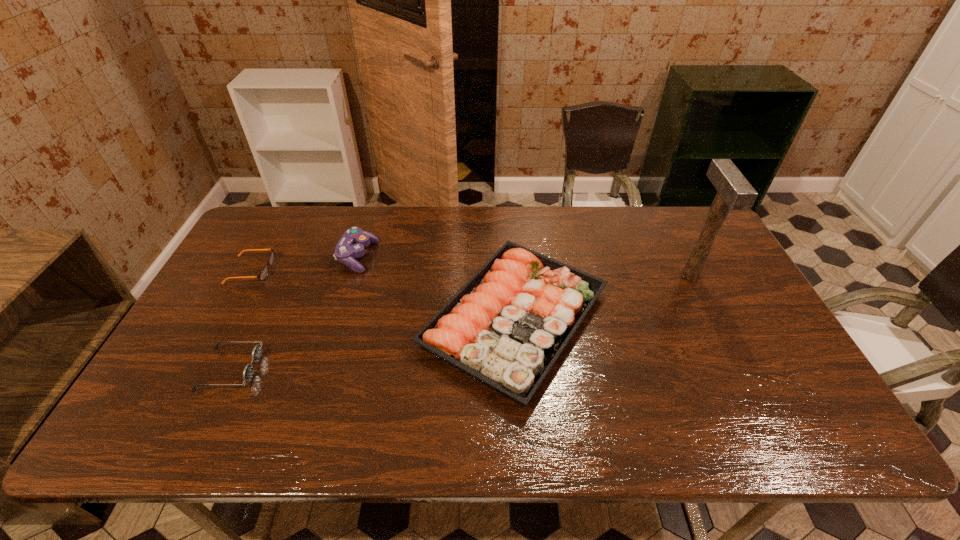
Locate an element on the screen. The height and width of the screenshot is (540, 960). the tallest object is located at coordinates (734, 192).

Identify the location of mallet. (734, 192).

This screenshot has width=960, height=540. I want to click on control, so click(351, 245).

Identify the location of the second object from right to left. (506, 327).

This screenshot has height=540, width=960. Identify the location of platter. (506, 327).

Find the location of a particular element. The height and width of the screenshot is (540, 960). the fourth tallest object is located at coordinates [248, 371].

I want to click on spectacles, so coord(265,271).

At what (x,y) coordinates should I click in order to perform the action: click on vacant area situated 0.370m on the left of the rightmost object. Please return your answer as a coordinate pair (x, y). This screenshot has height=540, width=960. Looking at the image, I should click on (561, 275).

At what (x,y) coordinates should I click in order to perform the action: click on free space located 0.160m on the front of the control. Please return your answer as a coordinate pair (x, y). This screenshot has height=540, width=960. Looking at the image, I should click on (341, 314).

Find the location of a particular element. free space located 0.390m on the right of the second object from right to left is located at coordinates (754, 319).